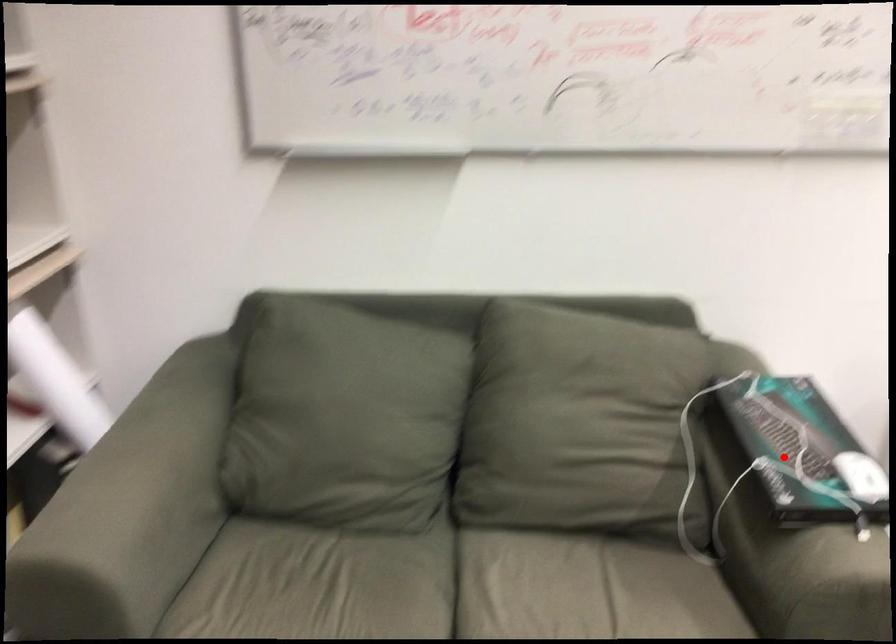
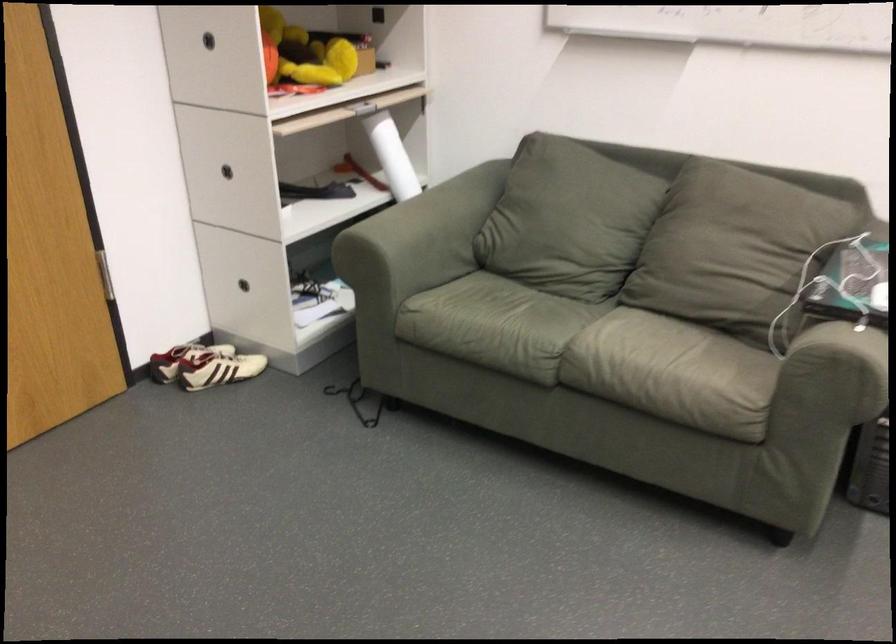
Question: I am providing you with two images of the same scene from different viewpoints. Given a red point in image1, look at the same physical point in image2. Is it:

Choices:
 (A) Closer to the viewpoint
 (B) Farther from the viewpoint

Answer: (B)